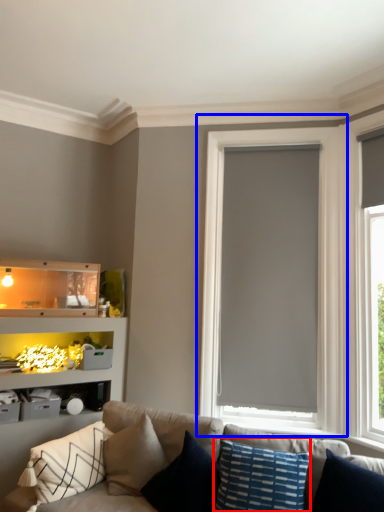
Question: Among these objects, which one is nearest to the camera, pillow (highlighted by a red box) or window (highlighted by a blue box)?

Choices:
 (A) pillow
 (B) window

Answer: (A)